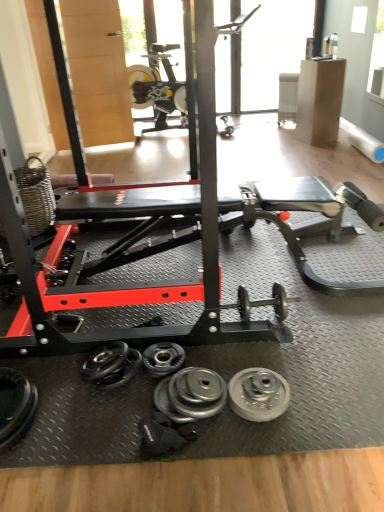
Find the location of `free space in front of silver metallic dumbbell at center, marked as the 2th dumbbell in a right-to-left arrangement`. free space in front of silver metallic dumbbell at center, marked as the 2th dumbbell in a right-to-left arrangement is located at coordinates (133, 402).